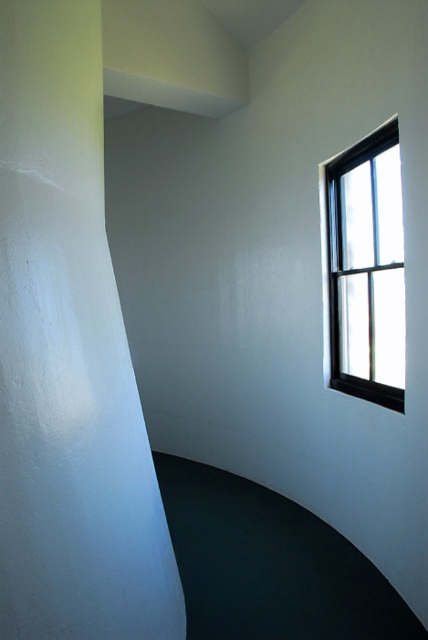
Question: Which of the following is the closest to the observer?

Choices:
 (A) black frame window at upper right
 (B) white matte pillar at left

Answer: (B)

Question: Can you confirm if white matte pillar at left is positioned above black frame window at upper right?

Choices:
 (A) yes
 (B) no

Answer: (B)

Question: Which of the following is the closest to the observer?

Choices:
 (A) white matte pillar at left
 (B) black frame window at upper right

Answer: (A)

Question: Does white matte pillar at left come in front of black frame window at upper right?

Choices:
 (A) yes
 (B) no

Answer: (A)

Question: Can you confirm if white matte pillar at left is smaller than black frame window at upper right?

Choices:
 (A) no
 (B) yes

Answer: (A)